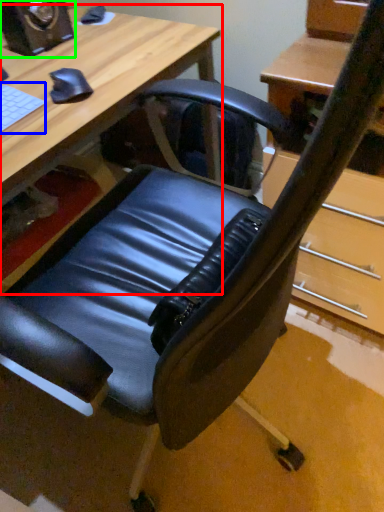
Question: Based on their relative distances, which object is farther from desk (highlighted by a red box)? Choose from laptop keyboard (highlighted by a blue box) and speaker (highlighted by a green box).

Choices:
 (A) laptop keyboard
 (B) speaker

Answer: (A)